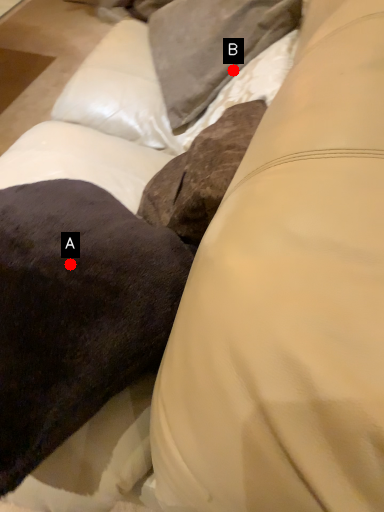
Question: Two points are circled on the image, labeled by A and B beside each circle. Which point is closer to the camera?

Choices:
 (A) A is closer
 (B) B is closer

Answer: (A)